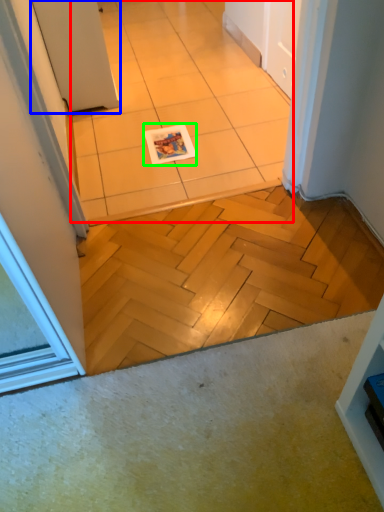
Question: Which is farther away from ceramic tile (highlighted by a red box)? door (highlighted by a blue box) or magazine (highlighted by a green box)?

Choices:
 (A) door
 (B) magazine

Answer: (A)